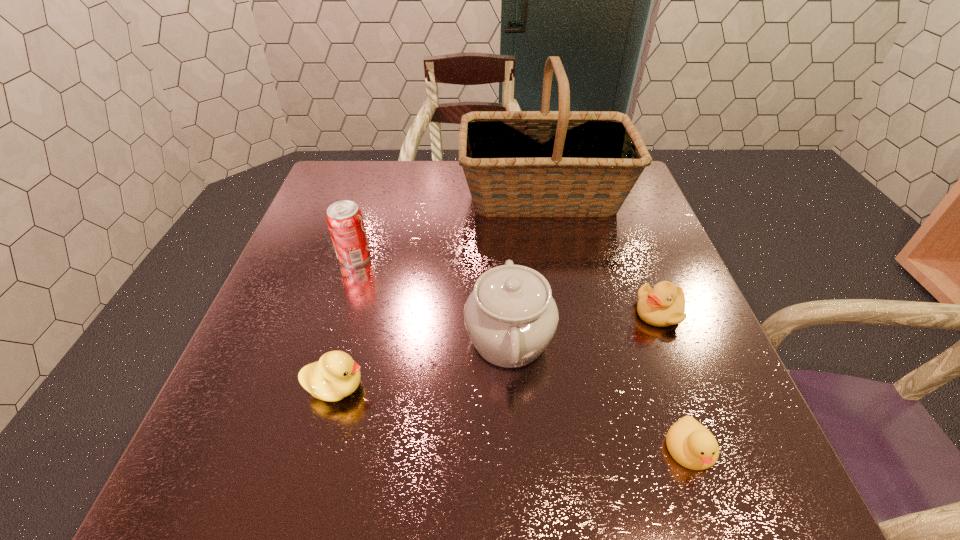
Where is `vacant space that satisfies the following two spatial constraints: 1. on the front-facing side of the farthest duckling; 2. on the face of the shortest object`? Image resolution: width=960 pixels, height=540 pixels. vacant space that satisfies the following two spatial constraints: 1. on the front-facing side of the farthest duckling; 2. on the face of the shortest object is located at coordinates (712, 449).

At what (x,y) coordinates should I click in order to perform the action: click on free space that satisfies the following two spatial constraints: 1. on the front side of the chinaware; 2. on the left side of the second farthest object. Please return your answer as a coordinate pair (x, y). The image size is (960, 540). Looking at the image, I should click on tap(329, 339).